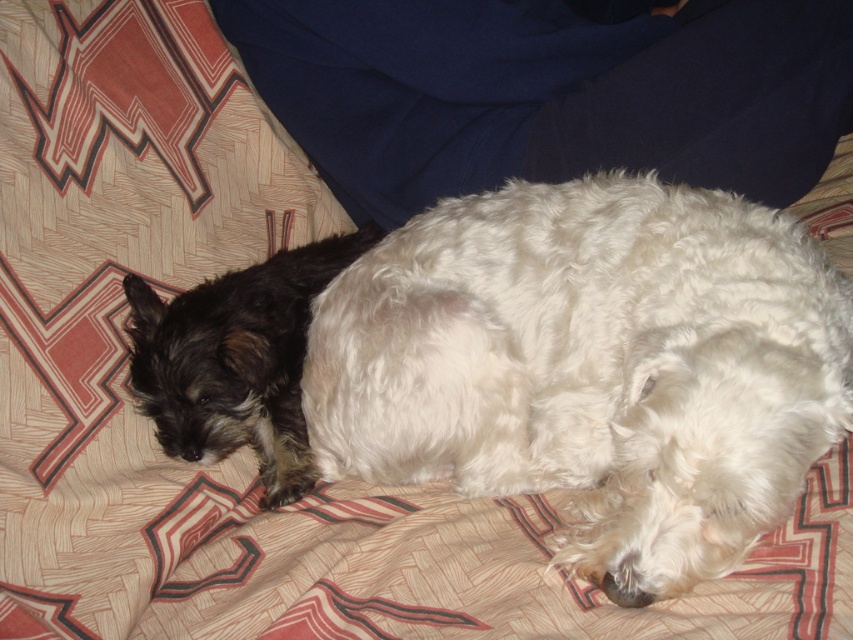
Question: Which point is closer to the camera?

Choices:
 (A) white fluffy dog at center
 (B) shaggy black dog at left

Answer: (A)

Question: From the image, what is the correct spatial relationship of white fluffy dog at center in relation to shaggy black dog at left?

Choices:
 (A) above
 (B) below

Answer: (B)

Question: Among these points, which one is farthest from the camera?

Choices:
 (A) (780, 310)
 (B) (213, 358)

Answer: (B)

Question: Among these points, which one is farthest from the camera?

Choices:
 (A) (415, 413)
 (B) (202, 420)

Answer: (B)

Question: Can you confirm if white fluffy dog at center is bigger than shaggy black dog at left?

Choices:
 (A) no
 (B) yes

Answer: (B)

Question: Is white fluffy dog at center below shaggy black dog at left?

Choices:
 (A) no
 (B) yes

Answer: (B)